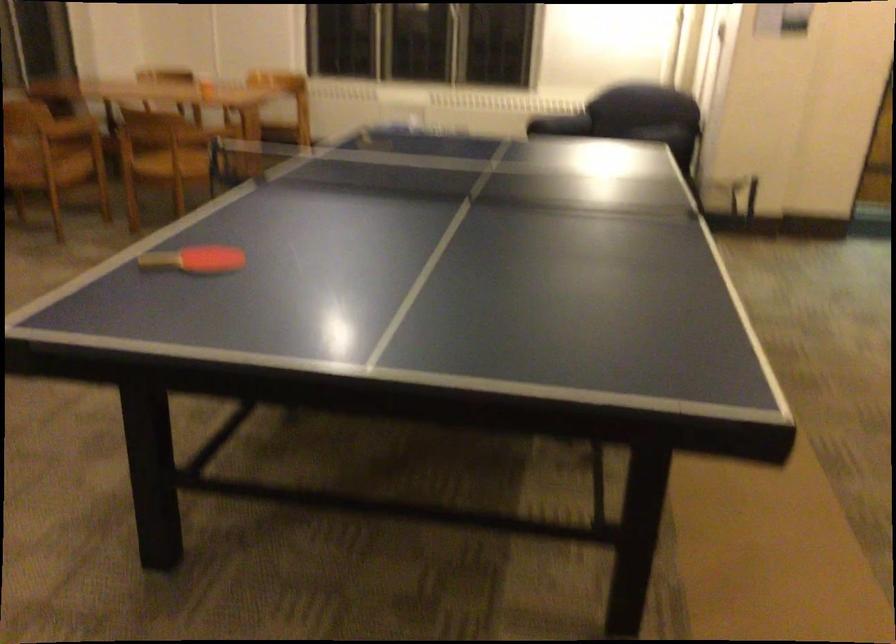
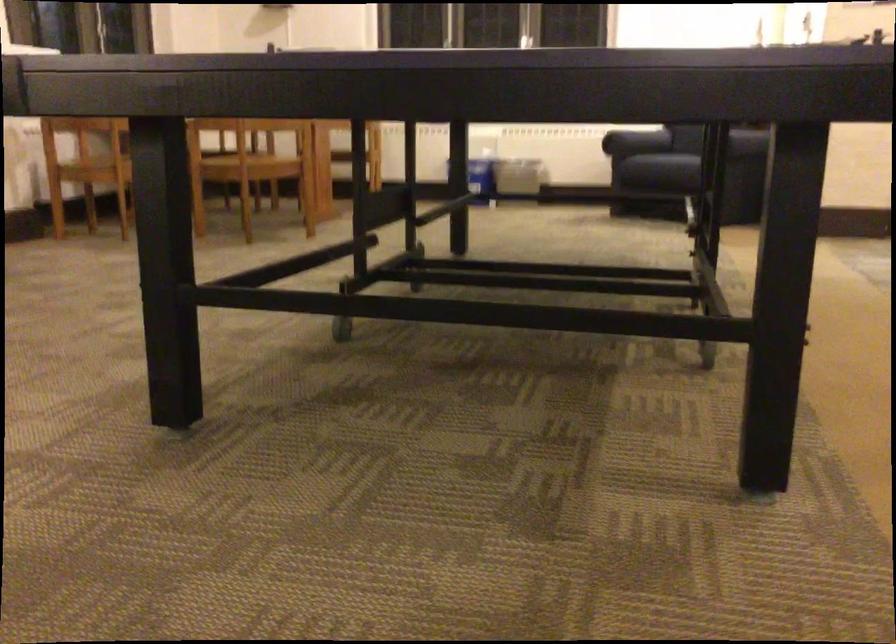
Where in the second image is the point corresponding to pixel 190 164 from the first image?

(248, 160)